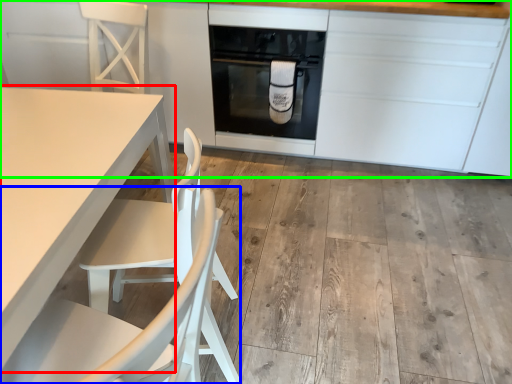
Question: Based on their relative distances, which object is farther from table (highlighted by a red box)? Choose from chair (highlighted by a blue box) and cabinetry (highlighted by a green box).

Choices:
 (A) chair
 (B) cabinetry

Answer: (B)